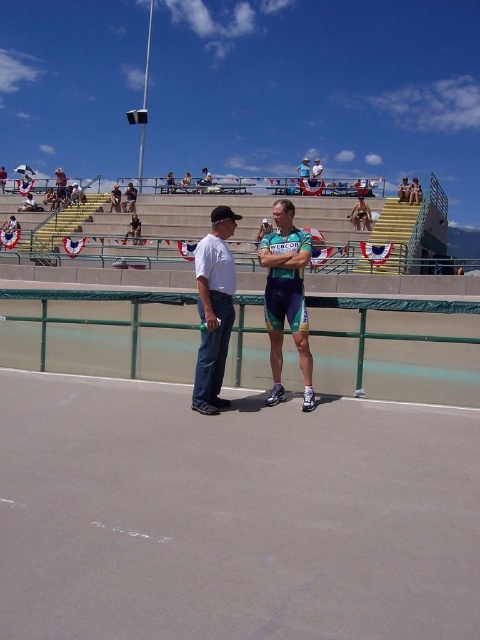
You are a photographer at the event and want to capture a photo that includes both the gray asphalt race track at center and the green jersey at center. Based on their positions, which object should appear to the left in the photo?

The gray asphalt race track at center is to the left of the green jersey at center, so in the photo, the gray asphalt race track at center will appear to the left of the green jersey at center.

You are standing at the point marked by the coordinate point (x=232, y=516) in the image. What is the surface you are standing on?

The surface at point (x=232, y=516) is the gray asphalt race track at center.